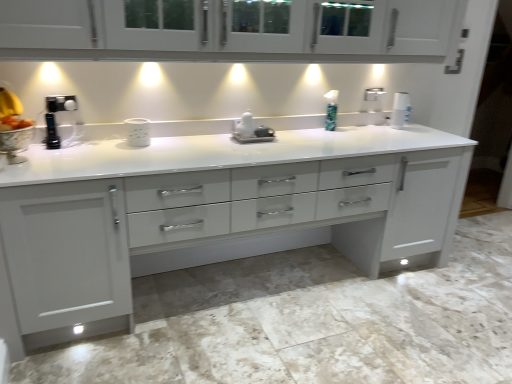
Question: From a real-world perspective, does white glossy cabinet at upper center sit lower than green plastic soap dispenser at center?

Choices:
 (A) yes
 (B) no

Answer: (B)

Question: Is white glossy cabinet at upper center closer to camera compared to green plastic soap dispenser at center?

Choices:
 (A) no
 (B) yes

Answer: (B)

Question: Is white glossy cabinet at upper center turned away from green plastic soap dispenser at center?

Choices:
 (A) no
 (B) yes

Answer: (A)

Question: Is white glossy cabinet at upper center facing towards green plastic soap dispenser at center?

Choices:
 (A) yes
 (B) no

Answer: (B)

Question: Is white glossy cabinet at upper center touching green plastic soap dispenser at center?

Choices:
 (A) yes
 (B) no

Answer: (B)

Question: Considering the positions of white glossy countertop at center and white glossy mug at center, positioned as the 2th appliance in back-to-front order, in the image, is white glossy countertop at center wider or thinner than white glossy mug at center, positioned as the 2th appliance in back-to-front order,?

Choices:
 (A) wide
 (B) thin

Answer: (A)

Question: Is point (217, 140) closer or farther from the camera than point (143, 137)?

Choices:
 (A) farther
 (B) closer

Answer: (A)

Question: From a real-world perspective, relative to white glossy mug at center, positioned as the 2th appliance in back-to-front order, is white glossy countertop at center vertically above or below?

Choices:
 (A) above
 (B) below

Answer: (B)

Question: In terms of size, does white glossy countertop at center appear bigger or smaller than white glossy mug at center, positioned as the 2th appliance in back-to-front order?

Choices:
 (A) big
 (B) small

Answer: (A)

Question: In terms of width, does white glossy paper towel at upper right look wider or thinner when compared to white glossy countertop at center?

Choices:
 (A) thin
 (B) wide

Answer: (A)

Question: From the image's perspective, is white glossy paper towel at upper right above or below white glossy countertop at center?

Choices:
 (A) above
 (B) below

Answer: (A)

Question: In terms of height, does white glossy paper towel at upper right look taller or shorter compared to white glossy countertop at center?

Choices:
 (A) tall
 (B) short

Answer: (B)

Question: Considering their positions, is white glossy paper towel at upper right located in front of or behind white glossy countertop at center?

Choices:
 (A) front
 (B) behind

Answer: (B)

Question: Would you say white glossy countertop at center is to the left or to the right of green plastic soap dispenser at center in the picture?

Choices:
 (A) left
 (B) right

Answer: (A)

Question: Looking at the image, does white glossy countertop at center seem bigger or smaller compared to green plastic soap dispenser at center?

Choices:
 (A) big
 (B) small

Answer: (A)